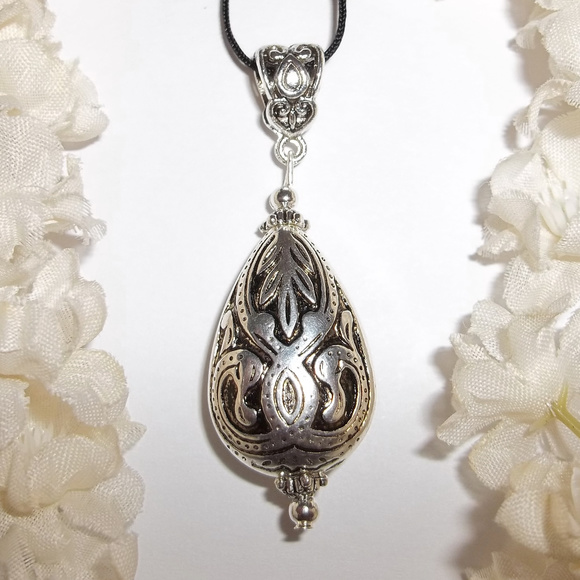
Where is `part of pendant attached to thread`? The height and width of the screenshot is (580, 580). part of pendant attached to thread is located at coordinates (284, 63).